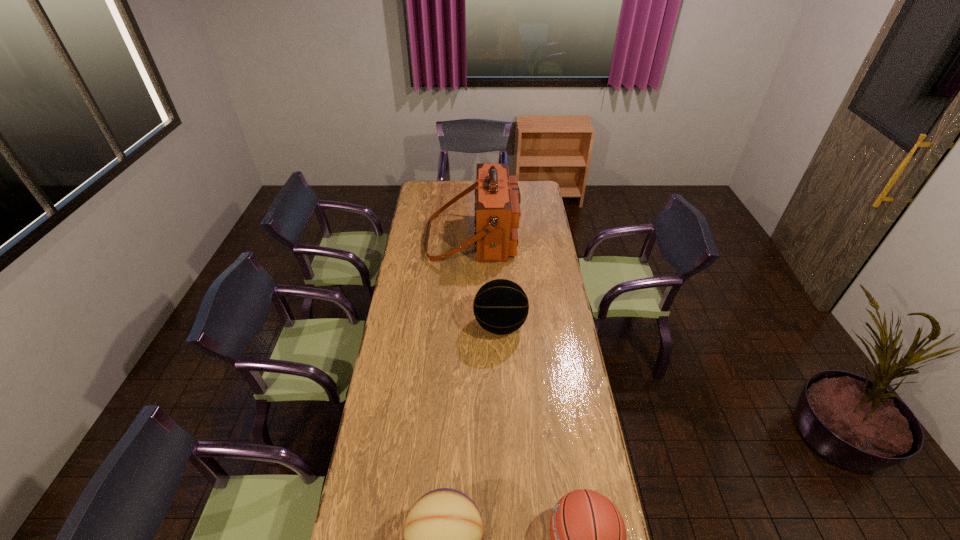
The width and height of the screenshot is (960, 540). What are the coordinates of `unoccupied position between the tallest object and the farthest basketball` in the screenshot? It's located at (487, 282).

Find the location of a particular element. This screenshot has width=960, height=540. free space between the farthest basketball and the tallest object is located at coordinates (487, 282).

Locate an element on the screen. This screenshot has width=960, height=540. object that stands as the third closest to the satchel is located at coordinates (588, 536).

You are a GUI agent. You are given a task and a screenshot of the screen. Output one action in this format:
    pyautogui.click(x=<x>, y=<y>)
    Task: Click on the object that is the second closest to the farthest object
    
    Given the screenshot: What is the action you would take?
    pyautogui.click(x=443, y=538)

Select which basketball is the closest to the second farthest object. Please provide its 2D coordinates. Your answer should be formatted as a tuple, i.e. [(x, y)], where the tuple contains the x and y coordinates of a point satisfying the conditions above.

[(443, 538)]

This screenshot has height=540, width=960. In order to click on basketball that can be found as the second closest to the second farthest object in this screenshot , I will do `click(588, 536)`.

Image resolution: width=960 pixels, height=540 pixels. Identify the location of free space that satisfies the following two spatial constraints: 1. on the face side of the farthest object; 2. on the back side of the second farthest object. [x=471, y=326].